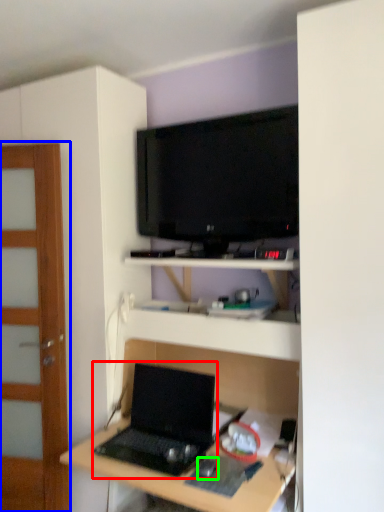
Question: Based on their relative distances, which object is farther from laptop (highlighted by a red box)? Choose from door (highlighted by a blue box) and mouse (highlighted by a green box).

Choices:
 (A) door
 (B) mouse

Answer: (A)